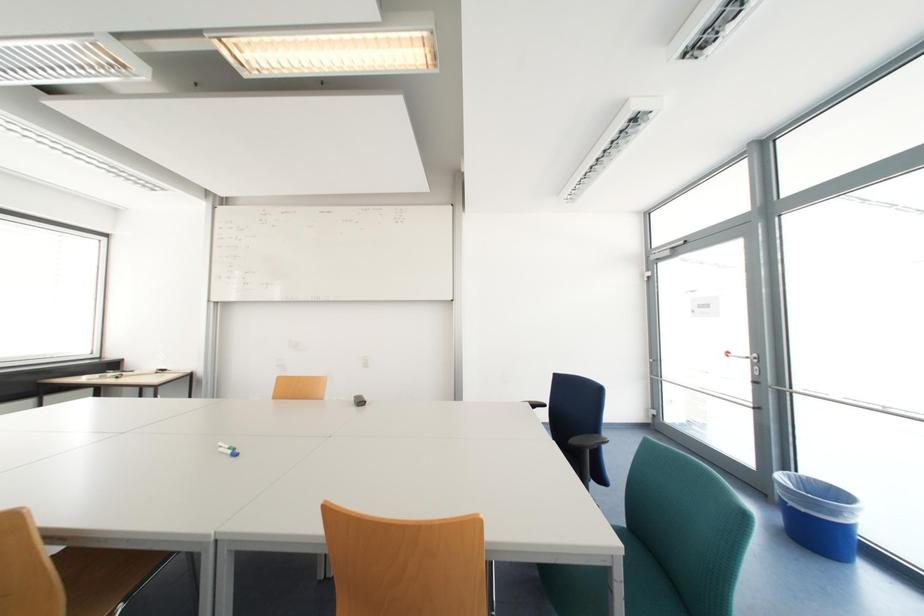
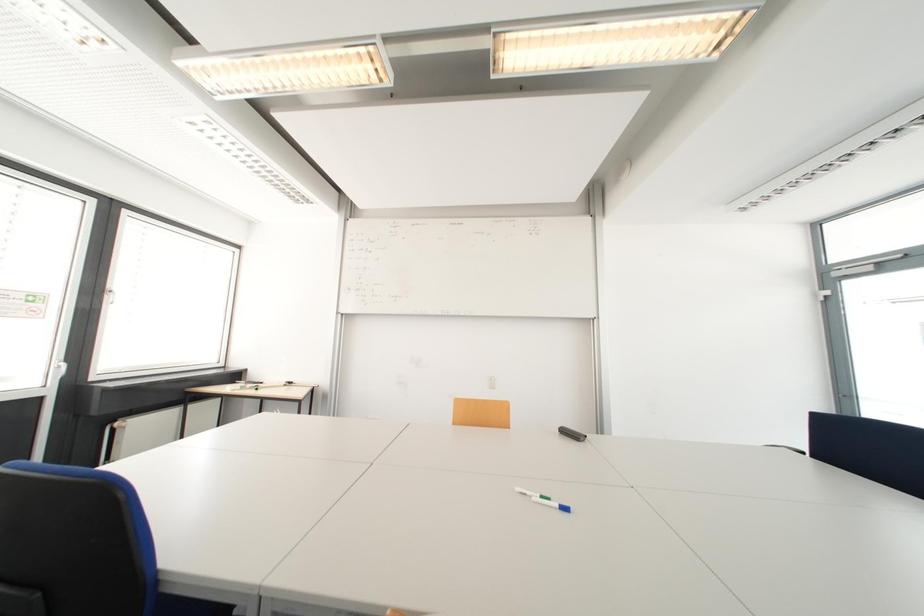
Question: Which direction would the cameraman need to move to produce the second image? Reply with the corresponding letter.

Choices:
 (A) Left
 (B) Right
 (C) Forward
 (D) Backward

Answer: (A)